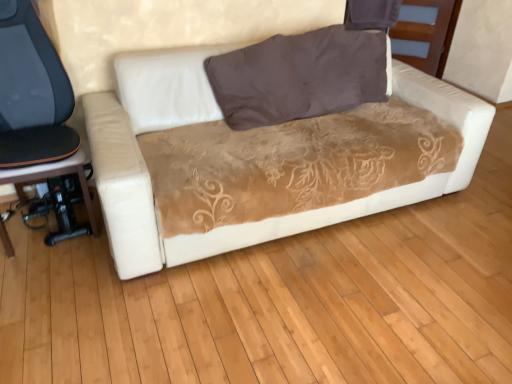
Locate an element on the screen. vacant space to the right of black plastic music stool at lower left is located at coordinates coord(98,233).